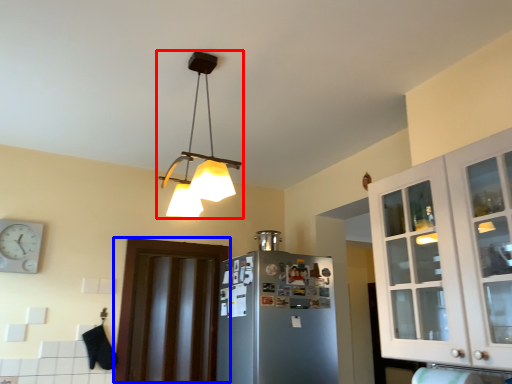
Question: Among these objects, which one is farthest to the camera, lamp (highlighted by a red box) or door (highlighted by a blue box)?

Choices:
 (A) lamp
 (B) door

Answer: (B)